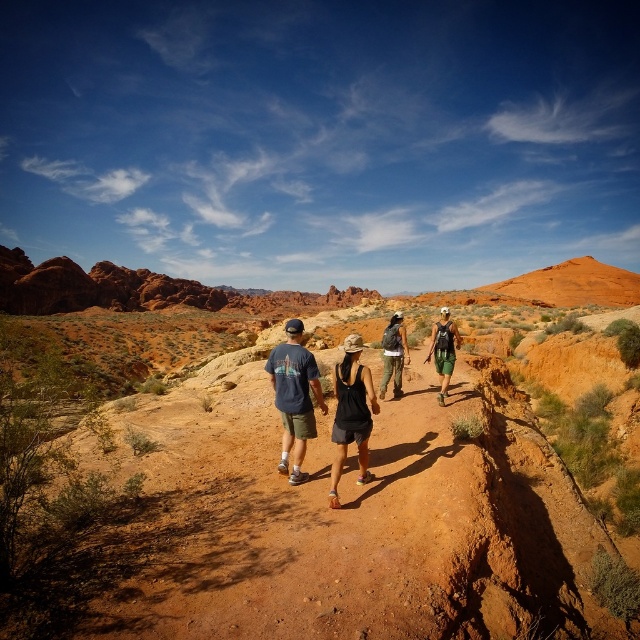
Question: Can you confirm if green fabric shorts at center is bigger than green camouflage pants at center?

Choices:
 (A) yes
 (B) no

Answer: (A)

Question: Which object is positioned farthest from the dark blue t-shirt at center?

Choices:
 (A) green fabric shorts at center
 (B) green camouflage pants at center

Answer: (A)

Question: Is black fabric tank top at center closer to the viewer compared to green camouflage pants at center?

Choices:
 (A) no
 (B) yes

Answer: (B)

Question: Which point is closer to the camera taking this photo?

Choices:
 (A) (294, 445)
 (B) (339, 465)
 (C) (384, 376)

Answer: (B)

Question: Which point appears closest to the camera in this image?

Choices:
 (A) (436, 362)
 (B) (298, 364)
 (C) (400, 340)
 (D) (333, 426)

Answer: (D)

Question: Does dark blue t-shirt at center appear under green fabric shorts at center?

Choices:
 (A) yes
 (B) no

Answer: (A)